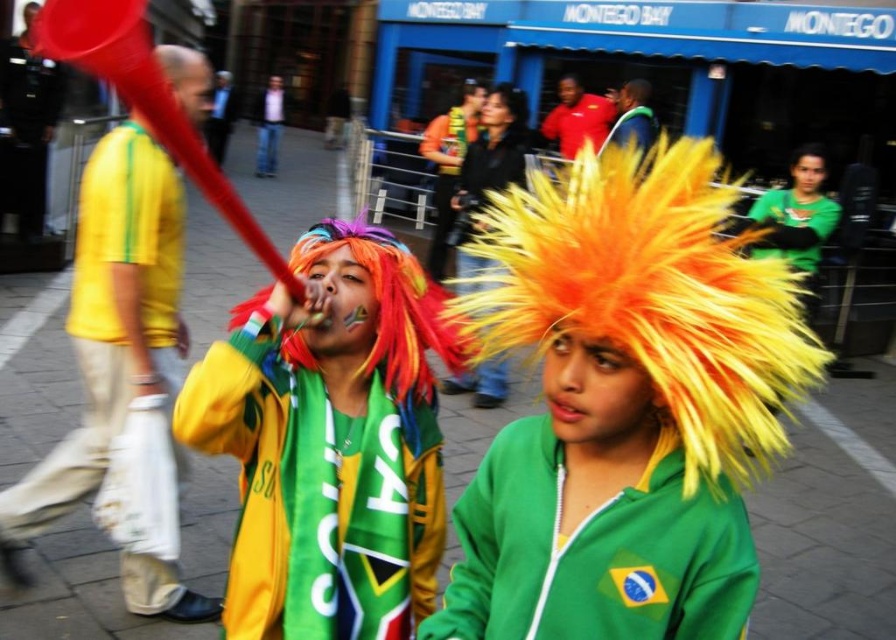
What do you see at coordinates (110, 324) in the screenshot? This screenshot has height=640, width=896. I see `yellow matte shirt at left` at bounding box center [110, 324].

Which is in front, point (157, 49) or point (450, 131)?

Point (157, 49) is in front.

Measure the distance between point (160,188) and camera.

Point (160,188) is 9.09 feet away from camera.

I want to click on yellow matte shirt at left, so click(110, 324).

Is green matte jacket at upper right bigger than matte red shirt at center?

Actually, green matte jacket at upper right might be smaller than matte red shirt at center.

Looking at this image, who is more forward, (765, 212) or (567, 125)?

Positioned in front is point (765, 212).

Identify the location of green matte jacket at upper right. The image size is (896, 640). (797, 218).

Which is behind, point (610, 532) or point (815, 211)?

The point (815, 211) is behind.

How distant is fluffy yellow-orange wig at center from green matte jacket at upper right?

fluffy yellow-orange wig at center is 14.01 feet from green matte jacket at upper right.

Identify the location of fluffy yellow-orange wig at center. (625, 406).